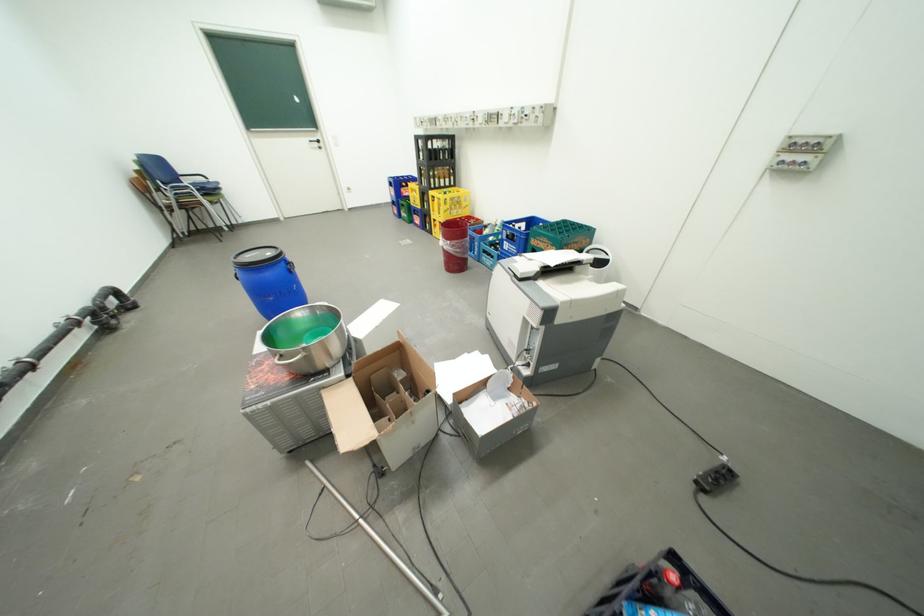
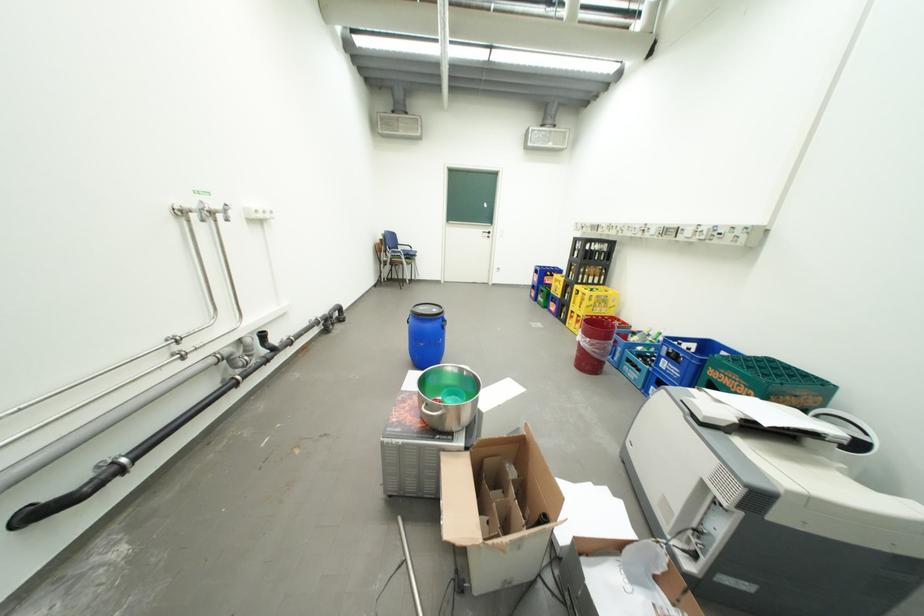
Find the pixel in the second image that matches point (459, 243) in the first image.

(599, 341)